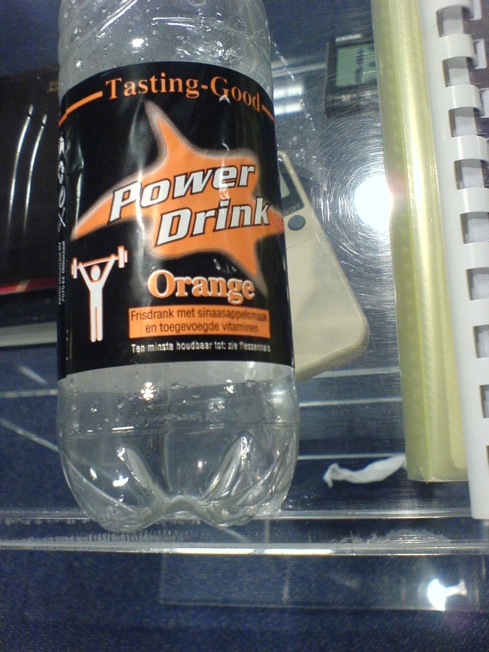
Identify the location of bottle. (111, 51).